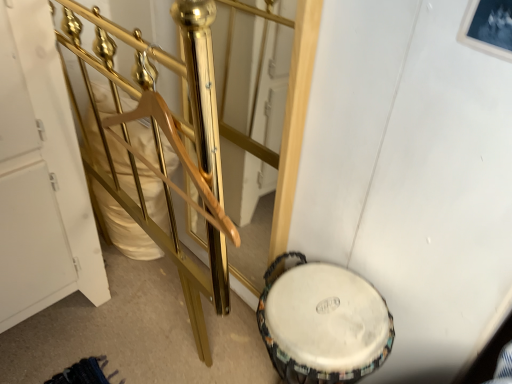
Question: Can you confirm if gold polished metal rail at center is taller than white fabric drum at lower right?

Choices:
 (A) yes
 (B) no

Answer: (B)

Question: Considering the relative sizes of gold polished metal rail at center and white fabric drum at lower right in the image provided, is gold polished metal rail at center bigger than white fabric drum at lower right?

Choices:
 (A) yes
 (B) no

Answer: (B)

Question: From a real-world perspective, is gold polished metal rail at center under white fabric drum at lower right?

Choices:
 (A) no
 (B) yes

Answer: (A)

Question: From the image's perspective, would you say gold polished metal rail at center is positioned over white fabric drum at lower right?

Choices:
 (A) yes
 (B) no

Answer: (A)

Question: Is white fabric drum at lower right completely or partially inside gold polished metal rail at center?

Choices:
 (A) no
 (B) yes

Answer: (A)

Question: Does gold polished metal rail at center come behind white fabric drum at lower right?

Choices:
 (A) no
 (B) yes

Answer: (A)

Question: From the image's perspective, is white fabric drum at lower right located above gold polished metal rail at center?

Choices:
 (A) no
 (B) yes

Answer: (A)

Question: Is white fabric drum at lower right facing towards gold polished metal rail at center?

Choices:
 (A) no
 (B) yes

Answer: (A)

Question: Considering the relative sizes of white fabric drum at lower right and gold polished metal rail at center in the image provided, is white fabric drum at lower right smaller than gold polished metal rail at center?

Choices:
 (A) yes
 (B) no

Answer: (B)

Question: Is gold polished metal rail at center located within white fabric drum at lower right?

Choices:
 (A) yes
 (B) no

Answer: (B)

Question: Is the depth of white fabric drum at lower right less than that of gold polished metal rail at center?

Choices:
 (A) yes
 (B) no

Answer: (B)

Question: Is white fabric drum at lower right positioned behind gold polished metal rail at center?

Choices:
 (A) no
 (B) yes

Answer: (B)

Question: From a real-world perspective, is gold polished metal rail at center above or below white fabric drum at lower right?

Choices:
 (A) above
 (B) below

Answer: (A)